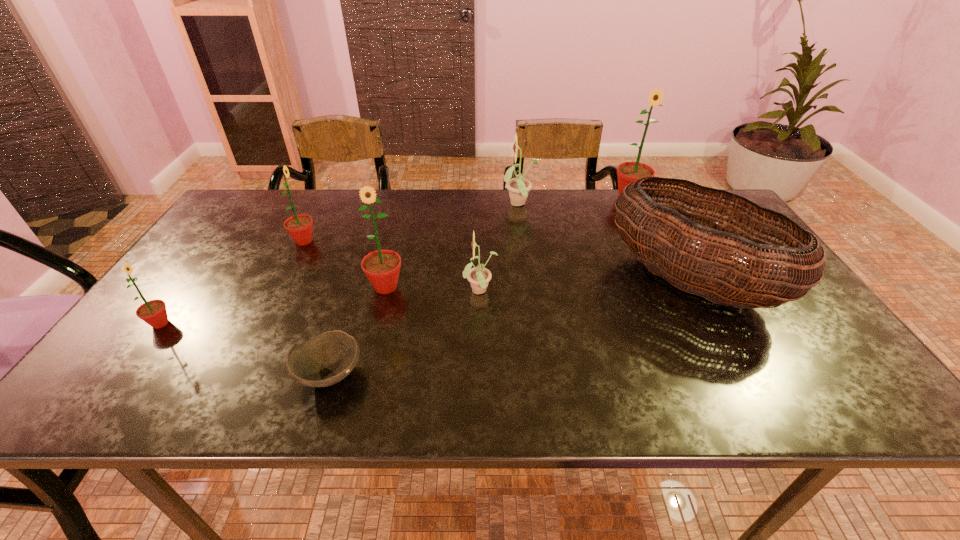
At what (x,y) coordinates should I click in order to perform the action: click on the nearer yellow sunflower. Please return your answer as a coordinate pair (x, y). Looking at the image, I should click on (479, 276).

Identify the location of the leftmost sunflower. Image resolution: width=960 pixels, height=540 pixels. (153, 312).

Where is `the leftmost object`? The width and height of the screenshot is (960, 540). the leftmost object is located at coordinates (153, 312).

Identify the location of the nearest object. The height and width of the screenshot is (540, 960). (326, 359).

Image resolution: width=960 pixels, height=540 pixels. What are the coordinates of `bowl` in the screenshot? It's located at (326, 359).

I want to click on free region located on the face of the rightmost green sunflower, so click(x=645, y=230).

This screenshot has height=540, width=960. I want to click on free space located 0.180m on the face of the third smallest green sunflower, so click(x=369, y=357).

Locate an element on the screen. vacant area situated 0.300m on the front-facing side of the farther yellow sunflower is located at coordinates (410, 205).

This screenshot has height=540, width=960. I want to click on vacant space located on the front-facing side of the farther yellow sunflower, so click(x=407, y=205).

Find the location of `free spot located 0.240m on the front-facing side of the farther yellow sunflower`. free spot located 0.240m on the front-facing side of the farther yellow sunflower is located at coordinates (428, 205).